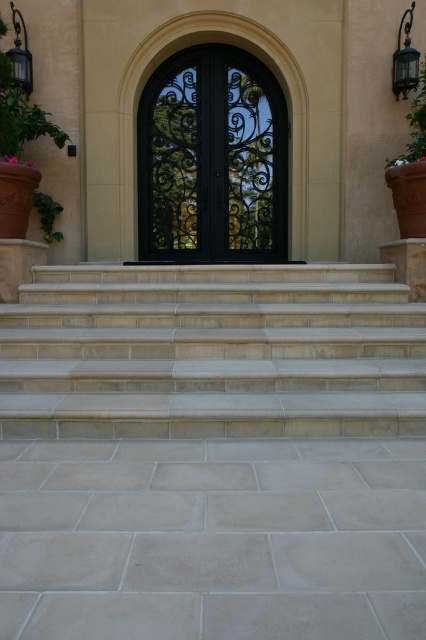
Looking at this image, can you confirm if beige stone stairs at center is wider than black wrought iron door at center?

Yes.

Between point (294, 326) and point (279, 152), which one is positioned behind?

The point (279, 152) is behind.

Find the location of a particular element. beige stone stairs at center is located at coordinates (212, 353).

Is beige stone stairs at center shorter than green leafy plant at left?

No, beige stone stairs at center is not shorter than green leafy plant at left.

Can you confirm if beige stone stairs at center is thinner than green leafy plant at left?

No.

This screenshot has height=640, width=426. What are the coordinates of `beige stone stairs at center` in the screenshot? It's located at (212, 353).

Is green leafy plant at upper right smaller than green leafy plant at left?

Incorrect, green leafy plant at upper right is not smaller in size than green leafy plant at left.

Who is positioned more to the right, green leafy plant at upper right or green leafy plant at left?

green leafy plant at upper right

Between point (411, 109) and point (40, 211), which one is positioned behind?

The point (411, 109) is behind.

Image resolution: width=426 pixels, height=640 pixels. Identify the location of green leafy plant at upper right. (414, 128).